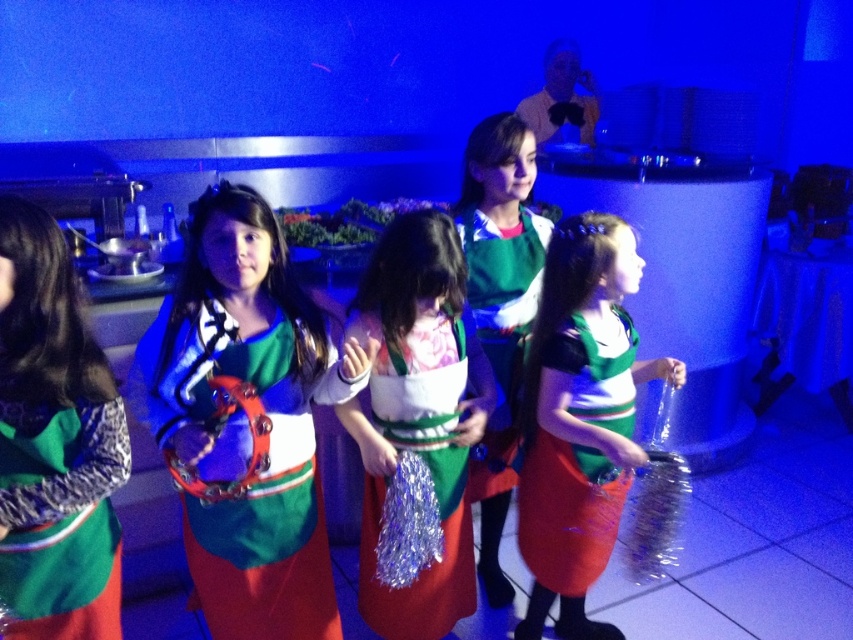
Question: Which of the following is the closest to the observer?

Choices:
 (A) green matte tambourine at left
 (B) green leafy vegetables at center
 (C) green matte dress at center
 (D) matte plastic tambourine at center

Answer: (A)

Question: Can you confirm if green matte tambourine at left is positioned below green leafy vegetables at center?

Choices:
 (A) yes
 (B) no

Answer: (A)

Question: Considering the real-world distances, which object is closest to the shiny metallic tambourine at center?

Choices:
 (A) green matte tambourine at left
 (B) shiny green dress at center

Answer: (B)

Question: Does matte plastic tambourine at center appear over green matte dress at center?

Choices:
 (A) no
 (B) yes

Answer: (B)

Question: Which of the following is the farthest from the observer?

Choices:
 (A) green matte dress at center
 (B) shiny metallic tambourine at center

Answer: (A)

Question: Is matte plastic tambourine at center below green leafy vegetables at center?

Choices:
 (A) yes
 (B) no

Answer: (A)